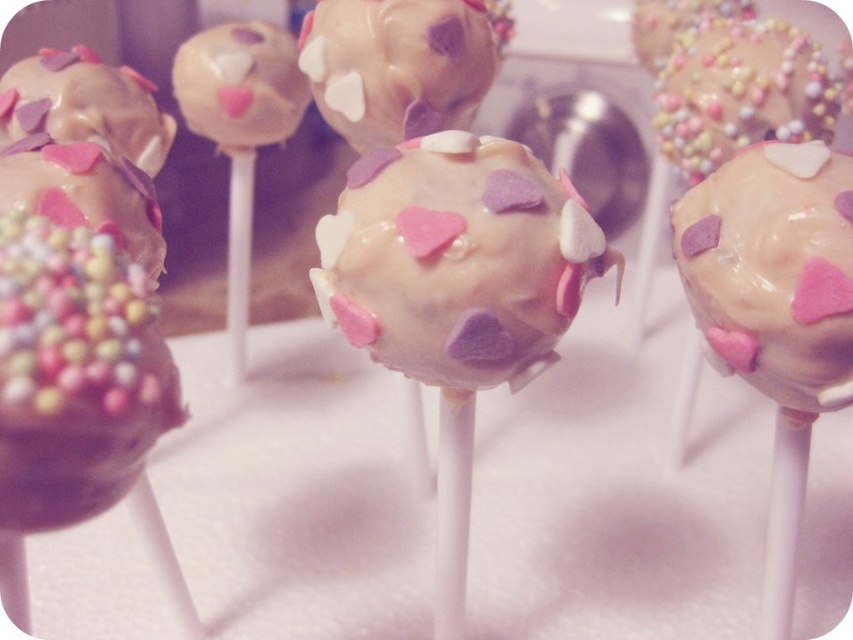
Which of these two, white glossy cake pop at center or chocolate-coated cake pop at left, stands shorter?

chocolate-coated cake pop at left

Does white glossy cake pop at center come in front of chocolate-coated cake pop at left?

→ No, white glossy cake pop at center is behind chocolate-coated cake pop at left.

Where is `white glossy cake pop at center`? This screenshot has height=640, width=853. white glossy cake pop at center is located at coordinates (457, 260).

Is point (480, 154) closer to viewer compared to point (332, 122)?

Yes, it is in front of point (332, 122).

Who is more distant from viewer, (384, 333) or (459, 52)?

Point (459, 52)

This screenshot has width=853, height=640. I want to click on white glossy cake pop at center, so click(x=457, y=260).

Is white glossy cake pop at center below glazed chocolate cake pop at upper right?

Indeed, white glossy cake pop at center is positioned under glazed chocolate cake pop at upper right.

Who is more distant from viewer, (434, 348) or (781, 115)?

The point (781, 115) is more distant.

Is point (379, 211) positioned before point (743, 125)?

Yes, it is in front of point (743, 125).

Where is `white glossy cake pop at center`? The height and width of the screenshot is (640, 853). white glossy cake pop at center is located at coordinates (457, 260).